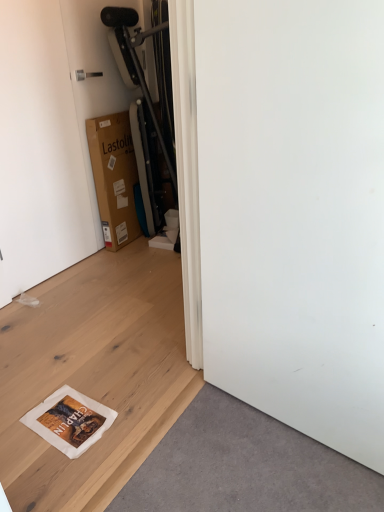
The height and width of the screenshot is (512, 384). What do you see at coordinates (40, 152) in the screenshot?
I see `white matte door at upper left` at bounding box center [40, 152].

Where is `brown cardboard box at upper left`? brown cardboard box at upper left is located at coordinates pos(114,177).

Is brown cardboard box at upper left positioned with its back to white matte plywood at lower left?

brown cardboard box at upper left is not turned away from white matte plywood at lower left.

Does brown cardboard box at upper left have a smaller size compared to white matte plywood at lower left?

No, brown cardboard box at upper left is not smaller than white matte plywood at lower left.

How many degrees apart are the facing directions of brown cardboard box at upper left and white matte plywood at lower left?

0.673 degrees.

Is brown cardboard box at upper left placed right next to white matte plywood at lower left?

No.

From a real-world perspective, relative to white matte screen door at lower right, is brown cardboard box at upper left vertically above or below?

From a real-world perspective, brown cardboard box at upper left is physically below white matte screen door at lower right.

Is the position of brown cardboard box at upper left more distant than that of white matte screen door at lower right?

Yes, brown cardboard box at upper left is further from the camera.

From the image's perspective, is brown cardboard box at upper left positioned above or below white matte screen door at lower right?

Clearly, from the image's perspective, brown cardboard box at upper left is above white matte screen door at lower right.

Which point is more distant from viewer, (95, 162) or (297, 346)?

The point (95, 162) is farther.

Which of these two, brown cardboard box at upper left or white matte door at upper left, is wider?

With larger width is brown cardboard box at upper left.

Would you say brown cardboard box at upper left is to the left or to the right of white matte door at upper left in the picture?

From the image, it's evident that brown cardboard box at upper left is to the right of white matte door at upper left.

In the scene shown: Is white matte door at upper left at the back of brown cardboard box at upper left?

No, brown cardboard box at upper left's orientation is not away from white matte door at upper left.

Which is in front, point (102, 183) or point (10, 259)?

The point (10, 259) is in front.

Consider the image. Could brown cardboard box at upper left be considered to be inside white matte plywood at lower left?

Actually, brown cardboard box at upper left is outside white matte plywood at lower left.

What's the angular difference between white matte plywood at lower left and brown cardboard box at upper left's facing directions?

The angle between the facing direction of white matte plywood at lower left and the facing direction of brown cardboard box at upper left is 0.673 degrees.

Looking at this image, from a real-world perspective, is white matte plywood at lower left above or below brown cardboard box at upper left?

From a real-world perspective, white matte plywood at lower left is physically below brown cardboard box at upper left.

Is point (115, 394) positioned after point (104, 134)?

That is False.

In the scene shown: Between white matte plywood at lower left and white matte door at upper left, which one has smaller size?

white matte door at upper left is smaller.

Where is `plywood that is under the white matte door at upper left (from a real-world perspective)`? The image size is (384, 512). plywood that is under the white matte door at upper left (from a real-world perspective) is located at coordinates (94, 374).

Is white matte plywood at lower left in front of or behind white matte door at upper left in the image?

Visually, white matte plywood at lower left is located in front of white matte door at upper left.

Can you confirm if white matte plywood at lower left is positioned to the right of white matte door at upper left?

Correct, you'll find white matte plywood at lower left to the right of white matte door at upper left.

Considering the sizes of white matte screen door at lower right and white matte plywood at lower left in the image, is white matte screen door at lower right wider or thinner than white matte plywood at lower left?

In the image, white matte screen door at lower right appears to be more narrow than white matte plywood at lower left.

Is white matte screen door at lower right next to white matte plywood at lower left?

There is a gap between white matte screen door at lower right and white matte plywood at lower left.

Which is in front, point (340, 422) or point (83, 269)?

The point (340, 422) is in front.

Can you confirm if white matte screen door at lower right is shorter than white matte plywood at lower left?

In fact, white matte screen door at lower right may be taller than white matte plywood at lower left.

Does white matte screen door at lower right have a greater width compared to white matte door at upper left?

Correct, the width of white matte screen door at lower right exceeds that of white matte door at upper left.

In terms of size, does white matte screen door at lower right appear bigger or smaller than white matte door at upper left?

In the image, white matte screen door at lower right appears to be larger than white matte door at upper left.

Considering their positions, is white matte screen door at lower right located in front of or behind white matte door at upper left?

white matte screen door at lower right is positioned closer to the viewer than white matte door at upper left.

Would you say white matte screen door at lower right is to the left or to the right of white matte door at upper left in the picture?

white matte screen door at lower right is to the right of white matte door at upper left.

The width and height of the screenshot is (384, 512). What are the coordinates of `cardboard box above the white matte plywood at lower left (from a real-world perspective)` in the screenshot? It's located at (114, 177).

Identify the location of screen door lying in front of the brown cardboard box at upper left. Image resolution: width=384 pixels, height=512 pixels. (294, 212).

When comparing their distances from white matte door at upper left, does brown cardboard box at upper left or white matte screen door at lower right seem further?

Based on the image, white matte screen door at lower right appears to be further to white matte door at upper left.

Which object lies further to the anchor point brown cardboard box at upper left, white matte screen door at lower right or white matte plywood at lower left?

white matte screen door at lower right is positioned further to the anchor brown cardboard box at upper left.

Estimate the real-world distances between objects in this image. Which object is further from white matte screen door at lower right, brown cardboard box at upper left or white matte plywood at lower left?

Among the two, brown cardboard box at upper left is located further to white matte screen door at lower right.

Considering their positions, is white matte plywood at lower left positioned further to white matte door at upper left than brown cardboard box at upper left?

The object further to white matte door at upper left is white matte plywood at lower left.

When comparing their distances from white matte door at upper left, does white matte screen door at lower right or white matte plywood at lower left seem further?

white matte screen door at lower right is positioned further to the anchor white matte door at upper left.

Which object lies nearer to the anchor point white matte plywood at lower left, brown cardboard box at upper left or white matte door at upper left?

white matte door at upper left is closer to white matte plywood at lower left.

When comparing their distances from white matte plywood at lower left, does white matte door at upper left or brown cardboard box at upper left seem closer?

white matte door at upper left lies closer to white matte plywood at lower left than the other object.

From the image, which object appears to be nearer to white matte door at upper left, white matte plywood at lower left or white matte screen door at lower right?

Among the two, white matte plywood at lower left is located nearer to white matte door at upper left.

Where is `plywood situated between white matte door at upper left and white matte screen door at lower right from left to right`? Image resolution: width=384 pixels, height=512 pixels. plywood situated between white matte door at upper left and white matte screen door at lower right from left to right is located at coordinates (94, 374).

The image size is (384, 512). I want to click on door located between white matte plywood at lower left and brown cardboard box at upper left in the depth direction, so click(x=40, y=152).

Identify the location of door between white matte screen door at lower right and brown cardboard box at upper left along the z-axis. This screenshot has height=512, width=384. (40, 152).

Find the location of `plywood located between white matte screen door at lower right and brown cardboard box at upper left in the depth direction`. plywood located between white matte screen door at lower right and brown cardboard box at upper left in the depth direction is located at coordinates (94, 374).